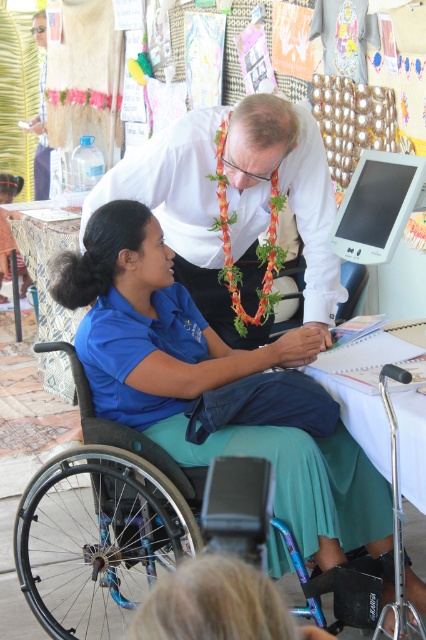
You are a photographer at the event and want to capture a photo of the white shirt at center and the matte plastic computer screen at upper right. Which object is taller in the image?

The white shirt at center is taller than the matte plastic computer screen at upper right according to the description.

You are a photographer at the event and want to take a photo of the white shirt at center without including the black plastic wheelchair at lower left in the frame. Is this possible given their positions?

The black plastic wheelchair at lower left is positioned on the left side of white shirt at center, so if you position yourself to the right of the white shirt at center, you can capture the white shirt at center without including the wheelchair in the frame.

You are a photographer at the event and want to capture both the woman in the wheelchair and the man standing beside her in a single shot. Which of the two points, point (x=316, y=275) or point (x=412, y=188), should you focus on first to ensure both subjects are in clear focus?

You should focus on point (x=316, y=275) first because it is closer to the viewer than point (x=412, y=188), ensuring the woman in the wheelchair is in focus while the man remains within the depth of field.